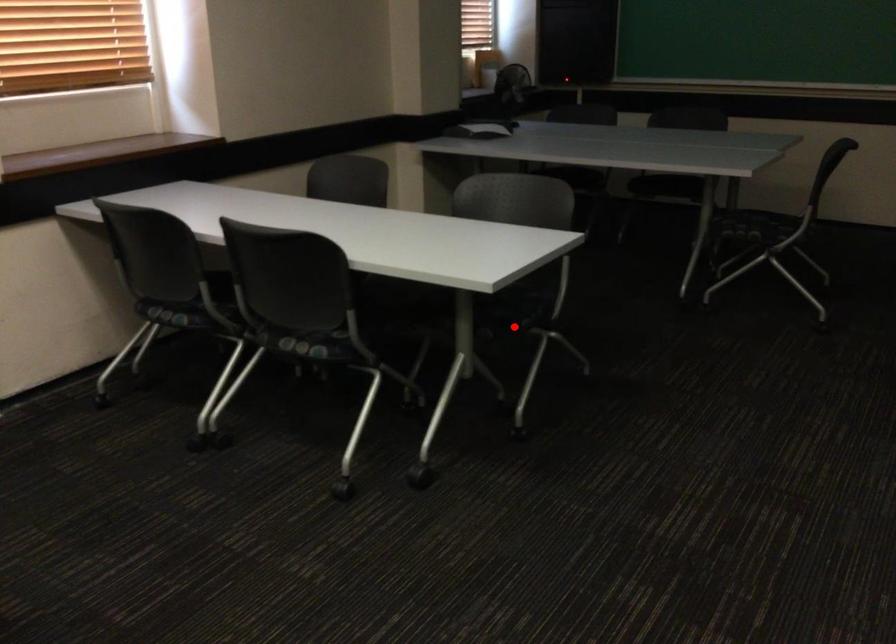
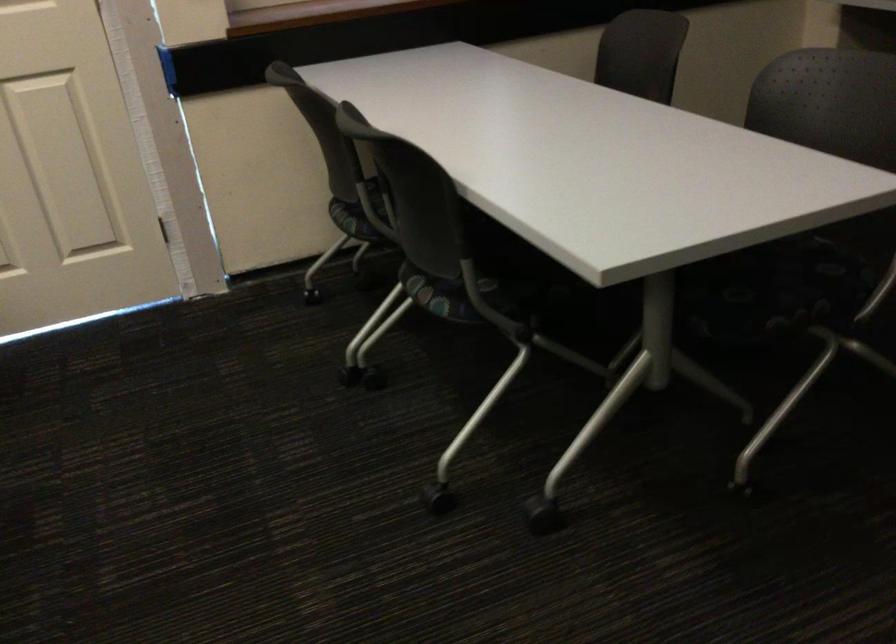
Question: I am providing you with two images of the same scene from different viewpoints. Image1 has a red point marked. In image2, the corresponding 3D location appears at what relative position? Reply with the corresponding letter.

Choices:
 (A) Closer
 (B) Farther

Answer: (A)